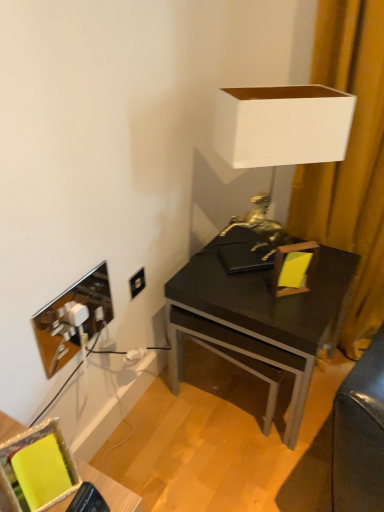
Find the location of `metallic reflective picture frame at lower left, which is the 2th picture frame from bottom to top`. metallic reflective picture frame at lower left, which is the 2th picture frame from bottom to top is located at coordinates (72, 319).

This screenshot has width=384, height=512. What do you see at coordinates (237, 358) in the screenshot? I see `black matte drawer at center` at bounding box center [237, 358].

What is the approximate height of yellow fabric curtain at right?

1.29 meters.

Describe the element at coordinates (260, 322) in the screenshot. I see `matte black desk at center` at that location.

I want to click on yellow fabric picture frame at lower left, the 2th picture frame when ordered from back to front, so click(27, 446).

Measure the distance between point (25,432) and camera.

The depth of point (25,432) is 29.41 inches.

The image size is (384, 512). I want to click on metallic reflective picture frame at lower left, the 1th picture frame when ordered from top to bottom, so click(x=72, y=319).

Considering the relative positions of white matte lampshade at upper right and yellow fabric curtain at right in the image provided, is white matte lampshade at upper right behind yellow fabric curtain at right?

Yes, it is behind yellow fabric curtain at right.

From the picture: From the image's perspective, which one is positioned higher, white matte lampshade at upper right or yellow fabric curtain at right?

white matte lampshade at upper right is shown above in the image.

From a real-world perspective, which object stands above the other?

white matte lampshade at upper right is physically above.

Find the location of a particular element. Image resolution: width=384 pixels, height=512 pixels. curtain lying below the white matte lampshade at upper right (from the image's perspective) is located at coordinates (350, 161).

Would you say white matte lampshade at upper right is part of yellow fabric picture frame at lower left, positioned as the 1th picture frame in front-to-back order,'s contents?

No, yellow fabric picture frame at lower left, positioned as the 1th picture frame in front-to-back order, does not contain white matte lampshade at upper right.

From a real-world perspective, who is located lower, yellow fabric picture frame at lower left, the 2th picture frame when ordered from back to front, or white matte lampshade at upper right?

From a 3D spatial view, yellow fabric picture frame at lower left, the 2th picture frame when ordered from back to front, is below.

Does point (33, 434) come behind point (307, 125)?

No, (33, 434) is in front of (307, 125).

Looking at this image, from the image's perspective, which object appears higher, black plastic power outlet at lower left or yellow fabric picture frame at lower left, which ranks as the second picture frame in top-to-bottom order?

black plastic power outlet at lower left is shown above in the image.

From a real-world perspective, is black plastic power outlet at lower left above or below yellow fabric picture frame at lower left, the 2th picture frame when ordered from back to front?

From a real-world perspective, black plastic power outlet at lower left is physically below yellow fabric picture frame at lower left, the 2th picture frame when ordered from back to front.

Where is `power outlet that appears behind the yellow fabric picture frame at lower left, positioned as the 1th picture frame in front-to-back order`? The image size is (384, 512). power outlet that appears behind the yellow fabric picture frame at lower left, positioned as the 1th picture frame in front-to-back order is located at coordinates (137, 283).

Can you tell me how much black plastic power outlet at lower left and yellow fabric picture frame at lower left, which is counted as the 1th picture frame, starting from the bottom, differ in facing direction?

black plastic power outlet at lower left and yellow fabric picture frame at lower left, which is counted as the 1th picture frame, starting from the bottom, are facing 25.3 degrees away from each other.

From the image's perspective, who appears lower, black plastic power outlet at lower left or metallic reflective picture frame at lower left, the second picture frame from the front?

From the image's view, metallic reflective picture frame at lower left, the second picture frame from the front, is below.

What's the angular difference between black plastic power outlet at lower left and metallic reflective picture frame at lower left, the second picture frame from the front,'s facing directions?

They differ by 0.0355 degrees in their facing directions.

Which of these two, black plastic power outlet at lower left or metallic reflective picture frame at lower left, which is the 2th picture frame from bottom to top, is smaller?

black plastic power outlet at lower left is smaller.

Considering the relative sizes of black plastic power outlet at lower left and white matte lampshade at upper right in the image provided, is black plastic power outlet at lower left taller than white matte lampshade at upper right?

In fact, black plastic power outlet at lower left may be shorter than white matte lampshade at upper right.

From the image's perspective, which is below, black plastic power outlet at lower left or white matte lampshade at upper right?

black plastic power outlet at lower left appears lower in the image.

Between black plastic power outlet at lower left and white matte lampshade at upper right, which one has larger width?

white matte lampshade at upper right is wider.

Relative to yellow fabric curtain at right, is matte black desk at center in front or behind?

matte black desk at center is positioned farther from the viewer than yellow fabric curtain at right.

From the image's perspective, is matte black desk at center below yellow fabric curtain at right?

Correct, matte black desk at center appears lower than yellow fabric curtain at right in the image.

Are matte black desk at center and yellow fabric curtain at right making contact?

They are not placed beside each other.

Does matte black desk at center have a greater width compared to yellow fabric curtain at right?

Yes, matte black desk at center is wider than yellow fabric curtain at right.

Does point (287, 429) come behind point (131, 281)?

That is False.

Is the surface of black matte drawer at center in direct contact with black plastic power outlet at lower left?

No, black matte drawer at center is not making contact with black plastic power outlet at lower left.

Where is `power outlet above the black matte drawer at center (from a real-world perspective)`? The image size is (384, 512). power outlet above the black matte drawer at center (from a real-world perspective) is located at coordinates click(x=137, y=283).

Identify the location of curtain on the right of the white matte lampshade at upper right. This screenshot has width=384, height=512. (350, 161).

You are a GUI agent. You are given a task and a screenshot of the screen. Output one action in this format:
    pyautogui.click(x=<x>, y=<y>)
    Task: Click on the lamp that is behind the yellow fabric picture frame at lower left, positioned as the 1th picture frame in front-to-back order
    This screenshot has height=512, width=384.
    Given the screenshot: What is the action you would take?
    pyautogui.click(x=282, y=126)

Considering their positions, is black matte drawer at center positioned closer to matte black desk at center than white matte lampshade at upper right?

black matte drawer at center.

Which object lies further to the anchor point white matte lampshade at upper right, metallic reflective picture frame at lower left, which is the 2th picture frame from bottom to top, or black matte drawer at center?

metallic reflective picture frame at lower left, which is the 2th picture frame from bottom to top, is positioned further to the anchor white matte lampshade at upper right.

Considering their positions, is yellow fabric picture frame at lower left, which is counted as the 1th picture frame, starting from the bottom, positioned further to yellow fabric curtain at right than metallic reflective picture frame at lower left, which is the 2th picture frame from bottom to top?

yellow fabric picture frame at lower left, which is counted as the 1th picture frame, starting from the bottom, is positioned further to the anchor yellow fabric curtain at right.

Based on their spatial positions, is metallic reflective picture frame at lower left, the 1th picture frame when ordered from top to bottom, or white matte lampshade at upper right closer to yellow fabric curtain at right?

Among the two, white matte lampshade at upper right is located nearer to yellow fabric curtain at right.

Looking at the image, which one is located closer to white matte lampshade at upper right, matte black desk at center or metallic reflective picture frame at lower left, which is the 2th picture frame from bottom to top?

matte black desk at center.

Considering their positions, is black plastic power outlet at lower left positioned further to yellow fabric picture frame at lower left, the 2th picture frame when ordered from back to front, than yellow fabric curtain at right?

yellow fabric curtain at right lies further to yellow fabric picture frame at lower left, the 2th picture frame when ordered from back to front, than the other object.

Based on the photo, considering their positions, is matte black desk at center positioned further to yellow fabric picture frame at lower left, the 2th picture frame when ordered from back to front, than black matte drawer at center?

Based on the image, matte black desk at center appears to be further to yellow fabric picture frame at lower left, the 2th picture frame when ordered from back to front.

Considering their positions, is metallic reflective picture frame at lower left, the second picture frame from the front, positioned closer to black plastic power outlet at lower left than yellow fabric curtain at right?

Among the two, metallic reflective picture frame at lower left, the second picture frame from the front, is located nearer to black plastic power outlet at lower left.

Where is `power outlet between white matte lampshade at upper right and black matte drawer at center in the vertical direction`? The image size is (384, 512). power outlet between white matte lampshade at upper right and black matte drawer at center in the vertical direction is located at coordinates (137, 283).

Locate an element on the screen. Image resolution: width=384 pixels, height=512 pixels. desk between yellow fabric picture frame at lower left, positioned as the 1th picture frame in front-to-back order, and yellow fabric curtain at right is located at coordinates (260, 322).

Where is `drawer positioned between yellow fabric picture frame at lower left, which is counted as the 1th picture frame, starting from the bottom, and black plastic power outlet at lower left from near to far`? drawer positioned between yellow fabric picture frame at lower left, which is counted as the 1th picture frame, starting from the bottom, and black plastic power outlet at lower left from near to far is located at coordinates (237, 358).

Where is `lamp located between black plastic power outlet at lower left and yellow fabric curtain at right in the left-right direction`? lamp located between black plastic power outlet at lower left and yellow fabric curtain at right in the left-right direction is located at coordinates (282, 126).